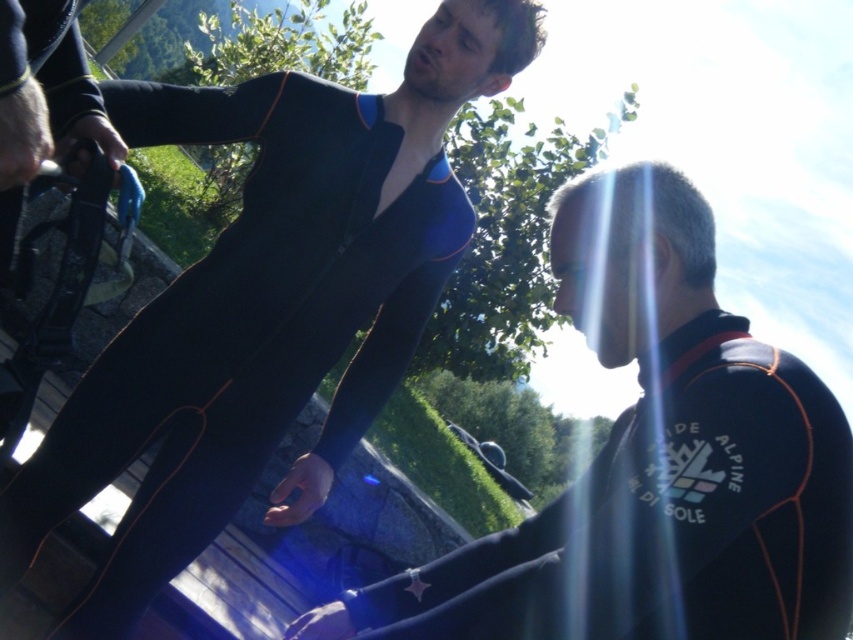
How far apart are black neoprene wetsuit at center and black neoprene wetsuit at right?

black neoprene wetsuit at center is 62.62 centimeters from black neoprene wetsuit at right.

Does black neoprene wetsuit at center appear under black neoprene wetsuit at right?

Actually, black neoprene wetsuit at center is above black neoprene wetsuit at right.

Image resolution: width=853 pixels, height=640 pixels. What do you see at coordinates (241, 330) in the screenshot?
I see `black neoprene wetsuit at center` at bounding box center [241, 330].

At what (x,y) coordinates should I click in order to perform the action: click on black neoprene wetsuit at center. Please return your answer as a coordinate pair (x, y). The width and height of the screenshot is (853, 640). Looking at the image, I should click on (241, 330).